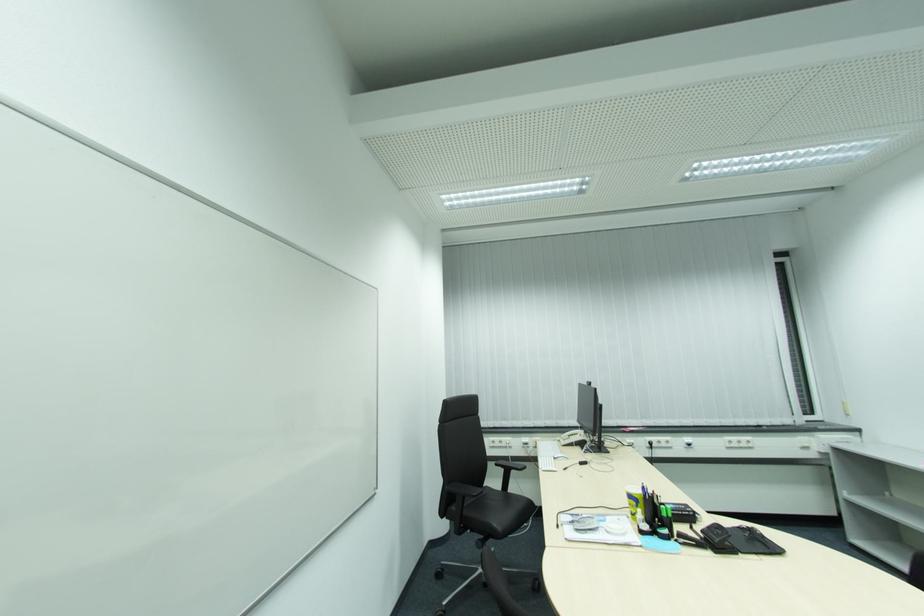
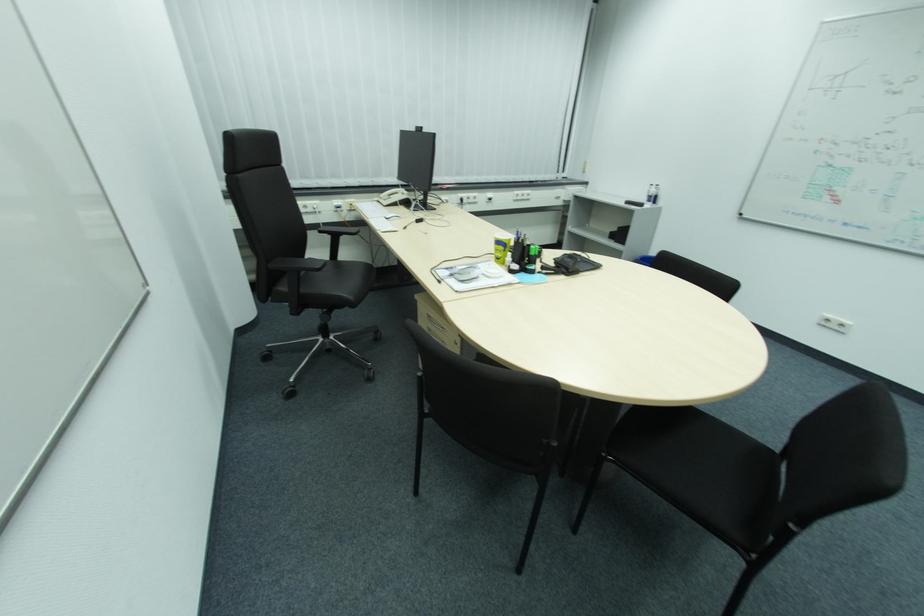
The point at (581, 435) is marked in the first image. Where is the corresponding point in the second image?

(403, 193)